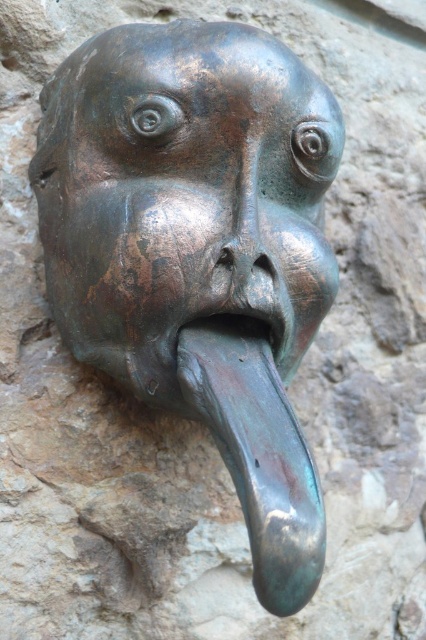
Is bronze sculpture at center to the right of bronze textured nose at center from the viewer's perspective?

Incorrect, bronze sculpture at center is not on the right side of bronze textured nose at center.

Looking at this image, who is more forward, [253,92] or [236,232]?

Positioned in front is point [236,232].

Measure the distance between point (54, 92) and camera.

A distance of 38.80 inches exists between point (54, 92) and camera.

At what (x,y) coordinates should I click in order to perform the action: click on bronze sculpture at center. Please return your answer as a coordinate pair (x, y). This screenshot has height=640, width=426. Looking at the image, I should click on tap(198, 246).

Between bronze sculpture at center and shiny bronze mouth at center, which one has less height?

shiny bronze mouth at center

Can you confirm if bronze sculpture at center is taller than shiny bronze mouth at center?

Correct, bronze sculpture at center is much taller as shiny bronze mouth at center.

The image size is (426, 640). What are the coordinates of `bronze sculpture at center` in the screenshot? It's located at (198, 246).

Does bronze textured nose at center have a lesser width compared to shiny bronze mouth at center?

Yes, bronze textured nose at center is thinner than shiny bronze mouth at center.

Based on the photo, can you confirm if bronze textured nose at center is shorter than shiny bronze mouth at center?

Incorrect, bronze textured nose at center's height does not fall short of shiny bronze mouth at center's.

This screenshot has width=426, height=640. I want to click on bronze textured nose at center, so click(247, 252).